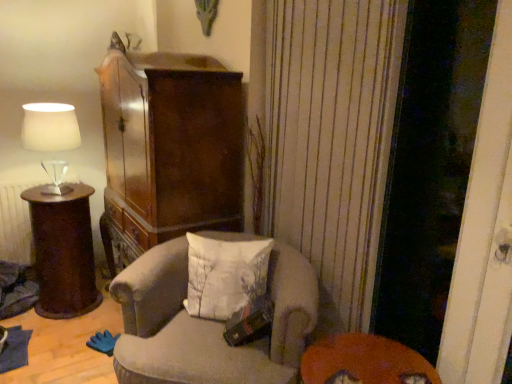
The height and width of the screenshot is (384, 512). In order to click on vacant area that is in front of dark brown polished wood side table at left in this screenshot , I will do `click(53, 334)`.